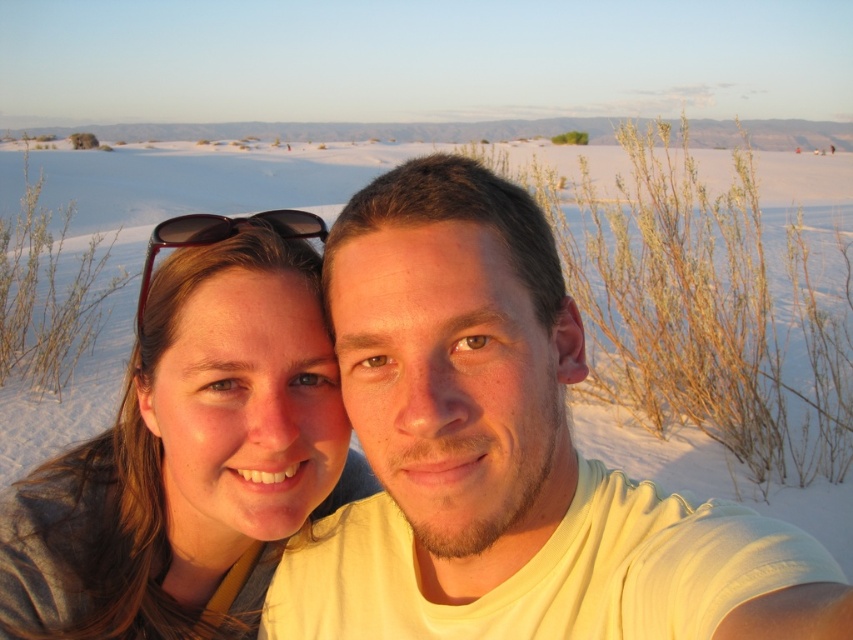
Does yellow cotton shirt at center have a greater width compared to black matte sunglasses at upper left?

Correct, the width of yellow cotton shirt at center exceeds that of black matte sunglasses at upper left.

Does yellow cotton shirt at center appear on the right side of black matte sunglasses at upper left?

Indeed, yellow cotton shirt at center is positioned on the right side of black matte sunglasses at upper left.

Is point (579, 500) positioned behind point (151, 237)?

That is False.

This screenshot has width=853, height=640. Identify the location of yellow cotton shirt at center. (506, 456).

Is matte gray hair at left wider than black matte sunglasses at upper left?

Correct, the width of matte gray hair at left exceeds that of black matte sunglasses at upper left.

Is point (256, 618) in front of point (218, 221)?

No.

Between point (299, 518) and point (183, 221), which one is positioned in front?

Point (299, 518) is more forward.

Find the location of a particular element. matte gray hair at left is located at coordinates (190, 452).

Does point (498, 182) lie in front of point (225, 449)?

That is True.

Is the position of yellow cotton shirt at center less distant than that of matte gray hair at left?

Yes, yellow cotton shirt at center is in front of matte gray hair at left.

Locate an element on the screen. The image size is (853, 640). yellow cotton shirt at center is located at coordinates pyautogui.click(x=506, y=456).